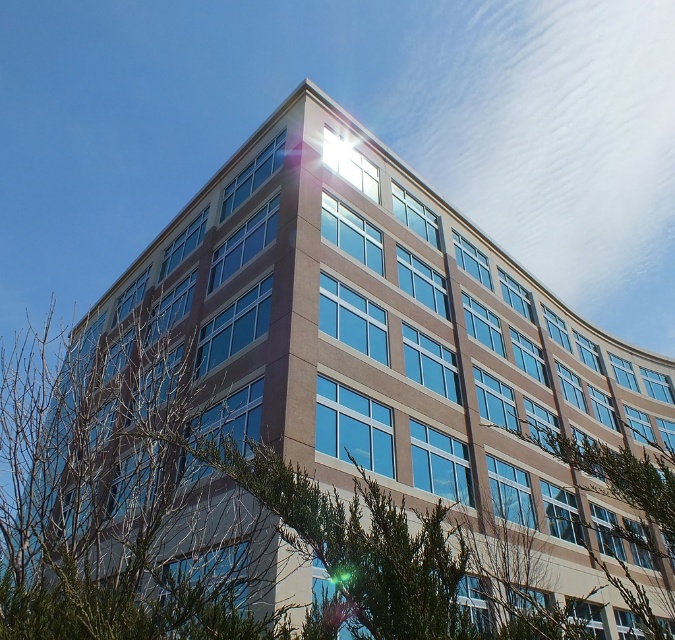
You are standing in front of the multi story building and want to know the position of the green leafy tree at center. Can you tell me where it is located in relation to the building?

The green leafy tree at center is located at point (119, 499) relative to the building.

You are standing in front of a modern building with a green leafy tree at center. If you want to take a photo of the tree without including the building in the frame, how far back should you move from your current position?

The green leafy tree at center is 12.74 feet away from viewer. To exclude the building from the photo, you should move back further than 12.74 feet so the tree is closer to the camera than the building.

You are standing in front of the building and notice two green leafy trees. Which tree, the green leafy tree at center or the green leafy tree at lower right, appears taller?

The green leafy tree at lower right is taller than the green leafy tree at center.